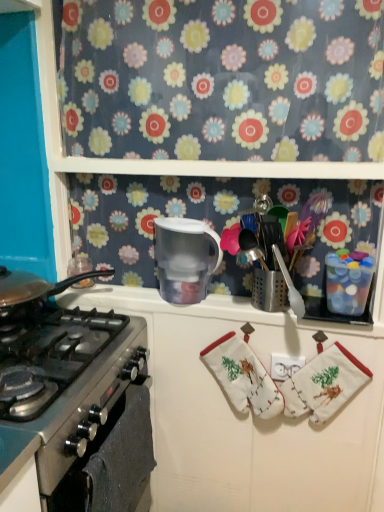
Question: From the image's perspective, does transparent plastic pitcher at center appear higher than white plastic outlet at center?

Choices:
 (A) yes
 (B) no

Answer: (A)

Question: From a real-world perspective, does transparent plastic pitcher at center sit lower than white plastic outlet at center?

Choices:
 (A) yes
 (B) no

Answer: (B)

Question: Considering the relative sizes of transparent plastic pitcher at center and white plastic outlet at center in the image provided, is transparent plastic pitcher at center thinner than white plastic outlet at center?

Choices:
 (A) no
 (B) yes

Answer: (A)

Question: Could you tell me if transparent plastic pitcher at center is turned towards white plastic outlet at center?

Choices:
 (A) no
 (B) yes

Answer: (A)

Question: Is transparent plastic pitcher at center to the right of white plastic outlet at center from the viewer's perspective?

Choices:
 (A) no
 (B) yes

Answer: (A)

Question: Relative to white cotton oven mitts at lower right, is floral fabric at upper center in front or behind?

Choices:
 (A) front
 (B) behind

Answer: (A)

Question: Looking at their shapes, would you say floral fabric at upper center is wider or thinner than white cotton oven mitts at lower right?

Choices:
 (A) thin
 (B) wide

Answer: (A)

Question: Would you say floral fabric at upper center is to the left or to the right of white cotton oven mitts at lower right in the picture?

Choices:
 (A) right
 (B) left

Answer: (B)

Question: In terms of height, does floral fabric at upper center look taller or shorter compared to white cotton oven mitts at lower right?

Choices:
 (A) short
 (B) tall

Answer: (B)

Question: From the image's perspective, is stainless steel gas stove at left positioned above or below white plastic outlet at center?

Choices:
 (A) below
 (B) above

Answer: (B)

Question: Considering the positions of point (137, 343) and point (279, 378), is point (137, 343) closer or farther from the camera than point (279, 378)?

Choices:
 (A) farther
 (B) closer

Answer: (A)

Question: Is stainless steel gas stove at left in front of or behind white plastic outlet at center in the image?

Choices:
 (A) front
 (B) behind

Answer: (A)

Question: Based on their sizes in the image, would you say stainless steel gas stove at left is bigger or smaller than white plastic outlet at center?

Choices:
 (A) small
 (B) big

Answer: (B)

Question: Is white cotton oven mitts at lower right situated inside floral fabric at upper center or outside?

Choices:
 (A) outside
 (B) inside

Answer: (A)

Question: From a real-world perspective, is white cotton oven mitts at lower right physically located above or below floral fabric at upper center?

Choices:
 (A) above
 (B) below

Answer: (B)